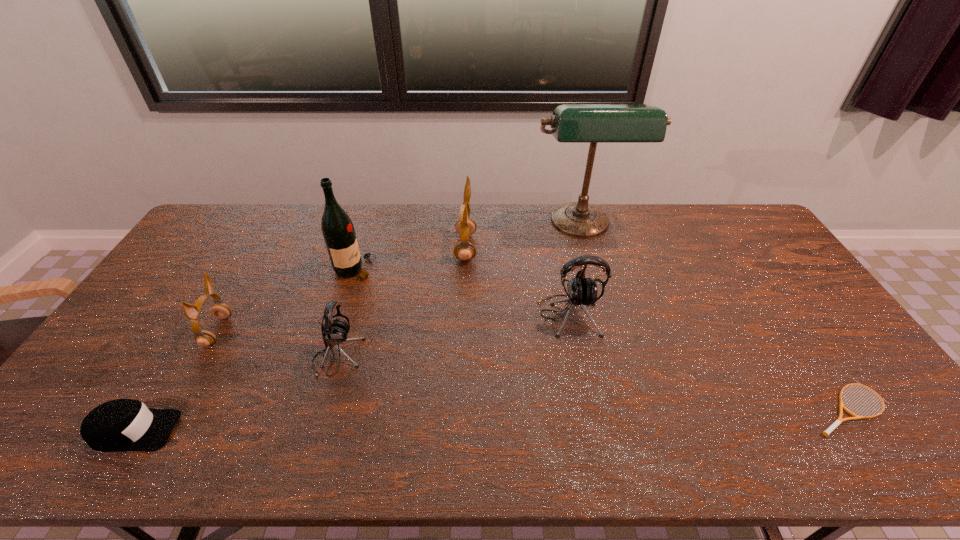
Locate an element on the screen. free spot between the bigger black earphone and the smaller brown earphone is located at coordinates (393, 323).

I want to click on vacant space in between the right brown earphone and the rightmost earphone, so click(x=517, y=281).

What are the coordinates of `free space between the shortest object and the bigger brown earphone` in the screenshot? It's located at (657, 328).

This screenshot has width=960, height=540. What are the coordinates of `free space between the bigger black earphone and the smaller brown earphone` in the screenshot? It's located at (393, 323).

At what (x,y) coordinates should I click in order to perform the action: click on blank region between the bigger brown earphone and the table lamp. Please return your answer as a coordinate pair (x, y). Looking at the image, I should click on (523, 237).

You are a GUI agent. You are given a task and a screenshot of the screen. Output one action in this format:
    pyautogui.click(x=<x>, y=<y>)
    Task: Click on the free space that is in between the cap and the seventh shortest object
    
    Given the screenshot: What is the action you would take?
    pyautogui.click(x=245, y=350)

Locate an element on the screen. This screenshot has width=960, height=540. object that can be found as the seventh closest to the right black earphone is located at coordinates (119, 425).

Find the location of `the seventh closest object to the farthest earphone`. the seventh closest object to the farthest earphone is located at coordinates (826, 433).

At what (x,y) coordinates should I click in order to perform the action: click on earphone that is the second closest to the right brown earphone. Please return your answer as a coordinate pair (x, y). Looking at the image, I should click on (335, 331).

The image size is (960, 540). What are the coordinates of `earphone that is the third nearest to the right brown earphone` in the screenshot? It's located at (204, 338).